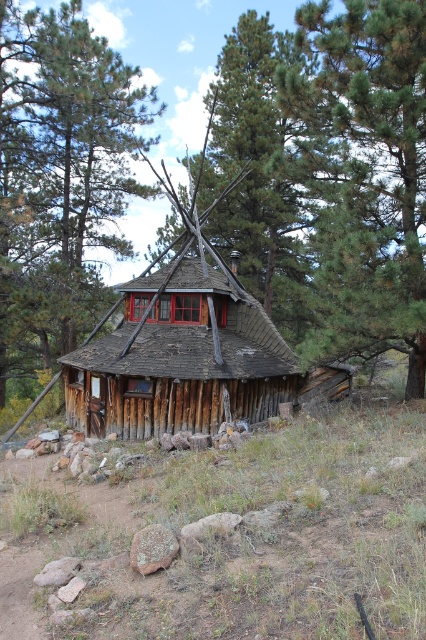
Is the position of green pine tree at upper center less distant than that of brown wooden cabin at center?

Yes.

The height and width of the screenshot is (640, 426). Describe the element at coordinates (363, 173) in the screenshot. I see `green pine tree at upper center` at that location.

This screenshot has height=640, width=426. Find the location of `green pine tree at upper center`. green pine tree at upper center is located at coordinates (363, 173).

Who is positioned more to the right, green textured pine trees at upper center or brown wooden cabin at center?

green textured pine trees at upper center is more to the right.

At what (x,y) coordinates should I click in order to perform the action: click on green textured pine trees at upper center. Please return your answer as a coordinate pair (x, y). The width and height of the screenshot is (426, 640). Looking at the image, I should click on (328, 173).

Who is lower down, green textured pine trees at upper center or green pine tree at upper center?

Positioned lower is green pine tree at upper center.

Image resolution: width=426 pixels, height=640 pixels. Describe the element at coordinates (328, 173) in the screenshot. I see `green textured pine trees at upper center` at that location.

Where is `green textured pine trees at upper center`? Image resolution: width=426 pixels, height=640 pixels. green textured pine trees at upper center is located at coordinates (328, 173).